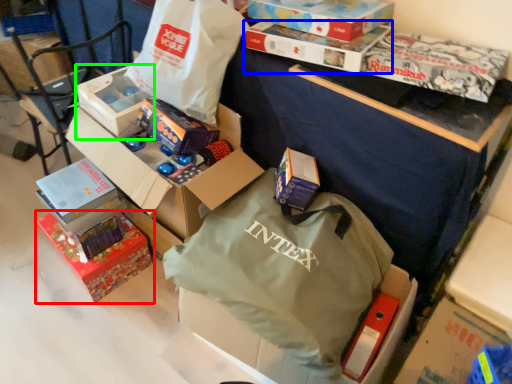
Question: Which is nearer to the box (highlighted by a red box)? box (highlighted by a blue box) or box (highlighted by a green box).

Choices:
 (A) box
 (B) box

Answer: (B)